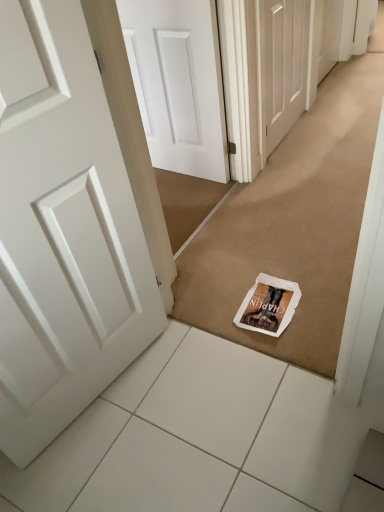
Question: Is white paper magazine at center behind white tile at lower center?

Choices:
 (A) no
 (B) yes

Answer: (B)

Question: From the image's perspective, is white paper magazine at center under white tile at lower center?

Choices:
 (A) yes
 (B) no

Answer: (B)

Question: Can you confirm if white paper magazine at center is wider than white tile at lower center?

Choices:
 (A) yes
 (B) no

Answer: (B)

Question: From the image's perspective, is white paper magazine at center above white tile at lower center?

Choices:
 (A) yes
 (B) no

Answer: (A)

Question: Can white tile at lower center be found inside white paper magazine at center?

Choices:
 (A) yes
 (B) no

Answer: (B)

Question: Is white paper magazine at center to the left of white tile at lower center from the viewer's perspective?

Choices:
 (A) yes
 (B) no

Answer: (B)

Question: Considering the relative sizes of white tile at lower center and white matte door at center, arranged as the second door when ordered from the bottom, in the image provided, is white tile at lower center bigger than white matte door at center, arranged as the second door when ordered from the bottom,?

Choices:
 (A) no
 (B) yes

Answer: (B)

Question: Is white tile at lower center oriented towards white matte door at center, arranged as the second door when ordered from the bottom?

Choices:
 (A) yes
 (B) no

Answer: (B)

Question: Is white matte door at center, arranged as the second door when ordered from the bottom, at the back of white tile at lower center?

Choices:
 (A) no
 (B) yes

Answer: (A)

Question: From a real-world perspective, is white tile at lower center under white matte door at center, marked as the 1th door in a right-to-left arrangement?

Choices:
 (A) no
 (B) yes

Answer: (B)

Question: From the image's perspective, would you say white tile at lower center is positioned over white matte door at center, acting as the second door starting from the left?

Choices:
 (A) yes
 (B) no

Answer: (B)

Question: Is white tile at lower center not close to white matte door at center, marked as the 1th door in a right-to-left arrangement?

Choices:
 (A) no
 (B) yes

Answer: (B)

Question: Is white matte door at center, which ranks as the 2th door in front-to-back order, far away from white paper doormat at center?

Choices:
 (A) no
 (B) yes

Answer: (A)